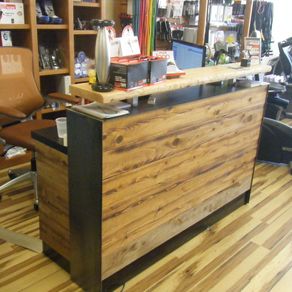
Locate an element on the screen. The width and height of the screenshot is (292, 292). computer screen is located at coordinates (193, 59).